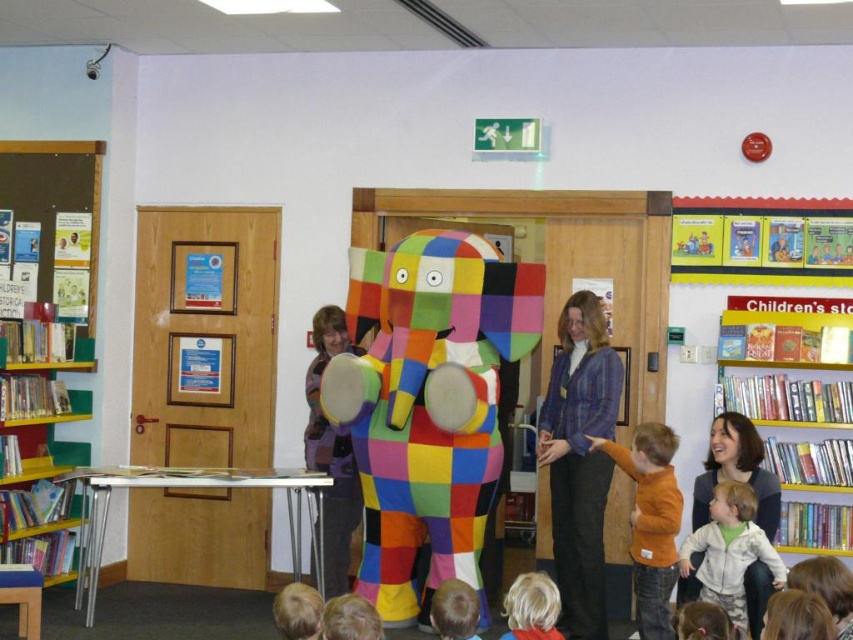
Question: Which object is farther from the camera taking this photo?

Choices:
 (A) multicolored plastic bookshelf at left
 (B) blonde hair at lower center

Answer: (A)

Question: Is blue plaid jacket at center below white fleece jacket at lower right?

Choices:
 (A) yes
 (B) no

Answer: (B)

Question: Which of the following is the closest to the observer?

Choices:
 (A) multicolored plastic bookshelf at left
 (B) wooden bookshelf at right
 (C) white fleece jacket at lower right
 (D) blue plaid jacket at center

Answer: (C)

Question: Is orange fleece sweater at lower center positioned before white fleece jacket at lower right?

Choices:
 (A) yes
 (B) no

Answer: (B)

Question: Is blonde hair at lower center above smooth brown hair at lower center?

Choices:
 (A) no
 (B) yes

Answer: (A)

Question: Which of the following is the closest to the observer?

Choices:
 (A) (463, 529)
 (B) (552, 486)
 (C) (827, 465)
 (D) (657, 588)

Answer: (D)